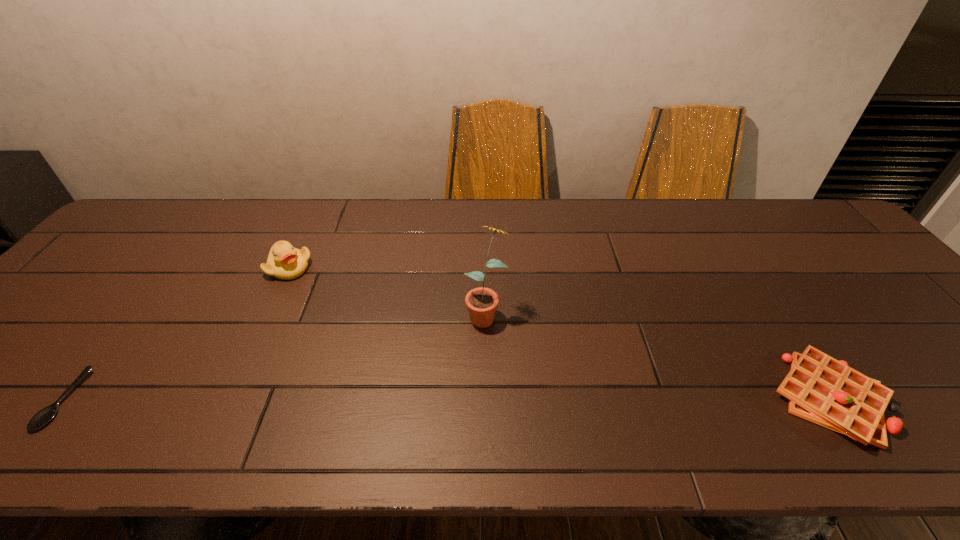
Where is `free spot located 0.080m on the flower of the tallest object`? The height and width of the screenshot is (540, 960). free spot located 0.080m on the flower of the tallest object is located at coordinates (460, 353).

This screenshot has width=960, height=540. In order to click on vacant space situated 0.090m on the flower of the tallest object in this screenshot , I will do `click(458, 356)`.

The image size is (960, 540). I want to click on vacant space situated on the flower of the tallest object, so click(x=458, y=356).

I want to click on vacant space located 0.310m at the face of the second object from left to right, so [390, 321].

What are the coordinates of `free space located 0.260m at the face of the second object from left to right` in the screenshot? It's located at (374, 313).

I want to click on blank area located 0.240m at the face of the second object from left to right, so click(369, 310).

This screenshot has width=960, height=540. In order to click on soupspoon that is at the near edge in this screenshot , I will do `click(41, 418)`.

Locate an element on the screen. The image size is (960, 540). waffle that is at the near edge is located at coordinates (821, 389).

Find the location of a particular element. This screenshot has width=960, height=540. vacant space at the far edge of the desktop is located at coordinates (746, 229).

I want to click on vacant region at the right edge of the desktop, so click(896, 335).